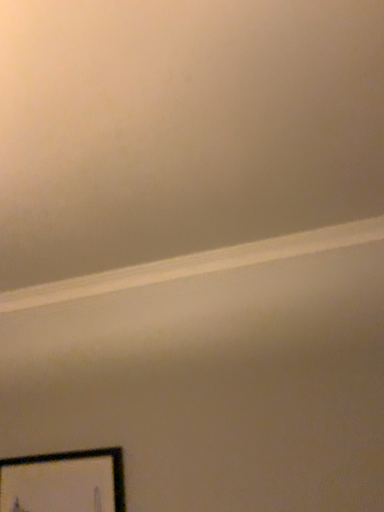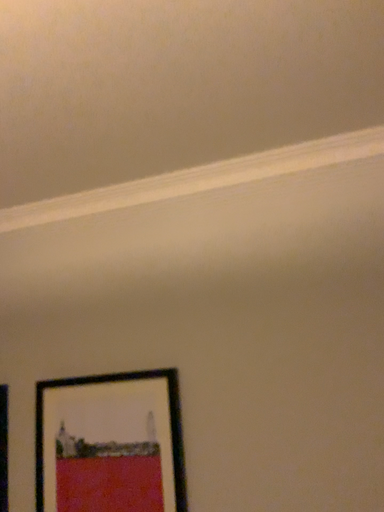
Question: Which way did the camera rotate in the video?

Choices:
 (A) rotated upward
 (B) rotated downward

Answer: (B)